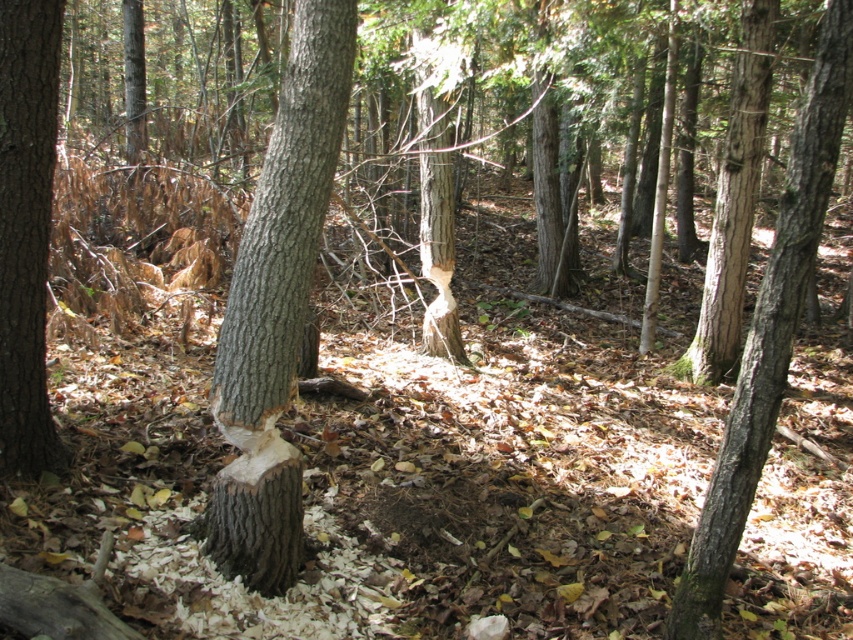
You are an ecologist studying tree bark characteristics in a forest. You observe the smooth gray bark at center and the smooth brown bark at left. Which of these two trees has a larger diameter?

The smooth gray bark at center has a larger diameter than the smooth brown bark at left.